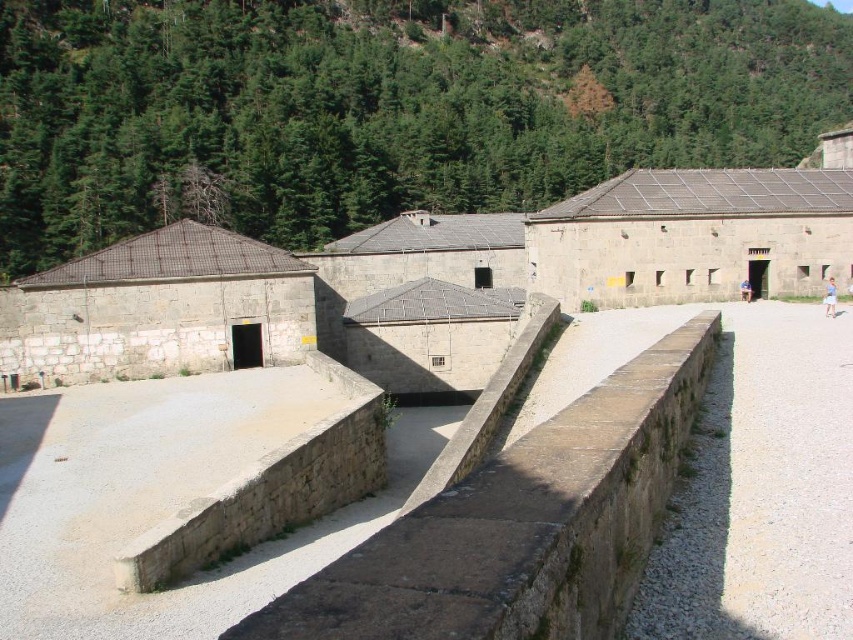
Question: Does green leafy hillside at upper left appear on the left side of brown stone wall at center?

Choices:
 (A) yes
 (B) no

Answer: (B)

Question: Can you confirm if green leafy hillside at upper left is positioned above blue denim jeans at center?

Choices:
 (A) yes
 (B) no

Answer: (A)

Question: Is stone wall at left below brown stone ledge at center?

Choices:
 (A) no
 (B) yes

Answer: (A)

Question: Which point is closer to the camera taking this photo?

Choices:
 (A) (576, 582)
 (B) (674, 632)
 (C) (125, 275)
 (D) (361, 145)

Answer: (A)

Question: Estimate the real-world distances between objects in this image. Which object is farther from the blue denim jeans at center?

Choices:
 (A) green leafy hillside at upper left
 (B) blue cotton dress at center-right
 (C) stone wall at left

Answer: (A)

Question: Which of the following is the farthest from the observer?

Choices:
 (A) brown stone ledge at center
 (B) blue denim jeans at center
 (C) stone wall at left

Answer: (B)